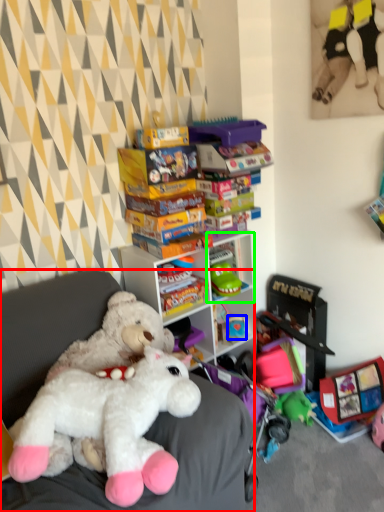
Question: Which is nearer to the furniture (highlighted by a red box)? toy (highlighted by a blue box) or shelf (highlighted by a green box).

Choices:
 (A) toy
 (B) shelf

Answer: (B)